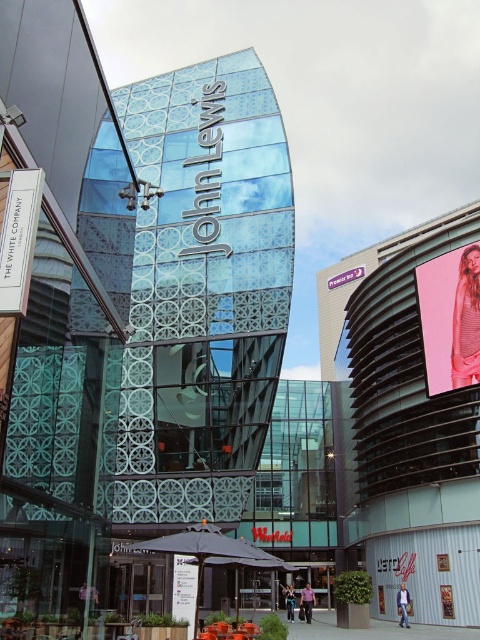
Which of these two, pink fabric billboard at upper right or matte white sign at center, stands shorter?

matte white sign at center

Is point (458, 355) in front of point (184, 568)?

No, (458, 355) is behind (184, 568).

Who is more distant from viewer, (x=472, y=252) or (x=186, y=588)?

Positioned behind is point (x=472, y=252).

Where is `pink fabric billboard at upper right`? This screenshot has width=480, height=640. pink fabric billboard at upper right is located at coordinates (451, 317).

Between point (33, 228) and point (192, 620), which one is positioned behind?

Point (192, 620)

Can you confirm if white paper sign at lower left is positioned to the left of matte white sign at center?

Correct, you'll find white paper sign at lower left to the left of matte white sign at center.

At what (x,y) coordinates should I click in order to perform the action: click on white paper sign at lower left. Please return your answer as a coordinate pair (x, y). The width and height of the screenshot is (480, 640). Looking at the image, I should click on (19, 237).

This screenshot has width=480, height=640. What are the coordinates of `white paper sign at lower left` in the screenshot? It's located at (19, 237).

Between point (472, 323) and point (37, 188), which one is positioned in front?

Point (37, 188) is in front.

Who is higher up, pink fabric billboard at upper right or white paper sign at lower left?

white paper sign at lower left

This screenshot has width=480, height=640. I want to click on pink fabric billboard at upper right, so click(x=451, y=317).